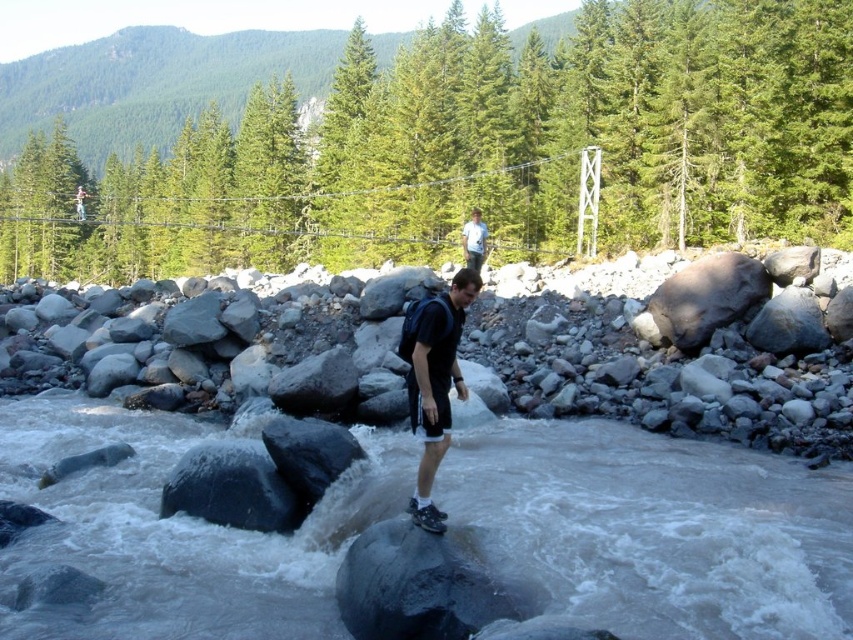
Is point (476, 506) positioned after point (83, 195)?

No, it is in front of (83, 195).

The width and height of the screenshot is (853, 640). Find the location of `gray smooth rock at center`. gray smooth rock at center is located at coordinates (654, 529).

Identify the location of gray smooth rock at center. The height and width of the screenshot is (640, 853). (654, 529).

Does gray smooth rock at center have a greater height compared to white cotton shirt at upper center?

No, gray smooth rock at center is not taller than white cotton shirt at upper center.

Locate an element on the screen. gray smooth rock at center is located at coordinates (654, 529).

Is gray rock at center wider than white cotton shirt at upper center?

Yes, gray rock at center is wider than white cotton shirt at upper center.

Is point (105, 332) positioned in front of point (466, 237)?

Yes.

The width and height of the screenshot is (853, 640). What do you see at coordinates (659, 358) in the screenshot? I see `gray rock at center` at bounding box center [659, 358].

Identify the location of gray rock at center. This screenshot has width=853, height=640. (659, 358).